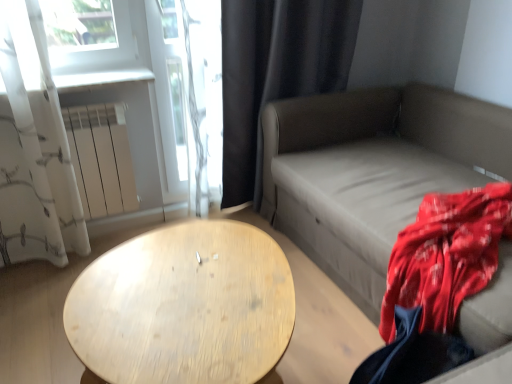
Identify the location of free location above light wood/texture table at center (from a real-world perspective). This screenshot has height=384, width=512. (189, 296).